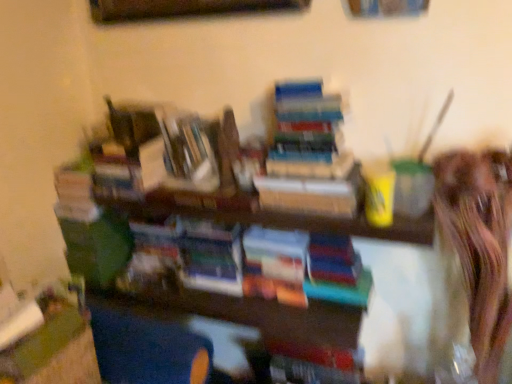
Image resolution: width=512 pixels, height=384 pixels. I want to click on hardcover book at center, the third book viewed from the right, so click(x=211, y=256).

Measure the distance between hardcover books at center, positioned as the fourth book in left-to-right order, and camera.

hardcover books at center, positioned as the fourth book in left-to-right order, is 1.20 meters from camera.

Where is `multicolored paper book at center, which is the third book from left to right`? This screenshot has width=512, height=384. multicolored paper book at center, which is the third book from left to right is located at coordinates pos(276,265).

The width and height of the screenshot is (512, 384). Identify the location of shiny brown hair at right. tap(479, 244).

Locate an element on the screen. Image resolution: width=512 pixels, height=384 pixels. hardcover book at center, acting as the 4th book starting from the right is located at coordinates (75, 195).

Is hardcover books at center, positioned as the fourth book in left-to-right order, to the left of hardcover book at center, arranged as the first book when viewed from the left, from the viewer's perspective?

No, hardcover books at center, positioned as the fourth book in left-to-right order, is not to the left of hardcover book at center, arranged as the first book when viewed from the left.

Is hardcover books at center, the first book when ordered from right to left, oriented towards hardcover book at center, acting as the 4th book starting from the right?

No, hardcover books at center, the first book when ordered from right to left, is not aimed at hardcover book at center, acting as the 4th book starting from the right.

Considering the relative sizes of hardcover books at center, positioned as the fourth book in left-to-right order, and hardcover book at center, acting as the 4th book starting from the right, in the image provided, is hardcover books at center, positioned as the fourth book in left-to-right order, taller than hardcover book at center, acting as the 4th book starting from the right,?

Yes, hardcover books at center, positioned as the fourth book in left-to-right order, is taller than hardcover book at center, acting as the 4th book starting from the right.

From the picture: Which point is more distant from viewer, (x=78, y=213) or (x=243, y=248)?

The point (x=78, y=213) is more distant.

In the image, is hardcover book at center, acting as the 4th book starting from the right, positioned in front of or behind multicolored paper book at center, which is the third book from left to right?

In the image, hardcover book at center, acting as the 4th book starting from the right, appears behind multicolored paper book at center, which is the third book from left to right.

In the image, is hardcover book at center, arranged as the first book when viewed from the left, on the left side or the right side of multicolored paper book at center, the second book positioned from the right?

hardcover book at center, arranged as the first book when viewed from the left, is to the left of multicolored paper book at center, the second book positioned from the right.

From their relative heights in the image, would you say hardcover book at center, arranged as the first book when viewed from the left, is taller or shorter than multicolored paper book at center, the second book positioned from the right?

hardcover book at center, arranged as the first book when viewed from the left, is shorter than multicolored paper book at center, the second book positioned from the right.

From a real-world perspective, relative to shiny brown hair at right, is multicolored paper book at center, which is the third book from left to right, vertically above or below?

multicolored paper book at center, which is the third book from left to right, is below shiny brown hair at right.

Are multicolored paper book at center, which is the third book from left to right, and shiny brown hair at right making contact?

They are not placed beside each other.

Is multicolored paper book at center, which is the third book from left to right, facing away from shiny brown hair at right?

multicolored paper book at center, which is the third book from left to right, does not have its back to shiny brown hair at right.

There is a multicolored paper book at center, which is the third book from left to right. Where is `person above it (from a real-world perspective)`? person above it (from a real-world perspective) is located at coordinates (479, 244).

From the image's perspective, is hardcover book at center, the third book viewed from the right, above or below hardcover book at center, acting as the 4th book starting from the right?

hardcover book at center, the third book viewed from the right, is situated lower than hardcover book at center, acting as the 4th book starting from the right, in the image.

Find the location of a particular element. The width and height of the screenshot is (512, 384). book that is the 1st one when counting downward from the hardcover book at center, arranged as the first book when viewed from the left (from the image's perspective) is located at coordinates (211, 256).

Considering the relative positions of hardcover book at center, the third book viewed from the right, and hardcover book at center, acting as the 4th book starting from the right, in the image provided, is hardcover book at center, the third book viewed from the right, to the right of hardcover book at center, acting as the 4th book starting from the right, from the viewer's perspective?

Yes, hardcover book at center, the third book viewed from the right, is to the right of hardcover book at center, acting as the 4th book starting from the right.

Based on the photo, does hardcover book at center, the third book viewed from the right, have a lesser width compared to hardcover book at center, acting as the 4th book starting from the right?

No.

Which book is the 3rd one when counting from the front of the hardcover book at center, arranged as the first book when viewed from the left? Please provide its 2D coordinates.

[(309, 154)]

Considering the sizes of objects hardcover book at center, acting as the 4th book starting from the right, and hardcover books at center, positioned as the fourth book in left-to-right order, in the image provided, who is shorter, hardcover book at center, acting as the 4th book starting from the right, or hardcover books at center, positioned as the fourth book in left-to-right order,?

hardcover book at center, acting as the 4th book starting from the right.

Between hardcover book at center, arranged as the first book when viewed from the left, and hardcover books at center, the first book when ordered from right to left, which one has smaller width?

With smaller width is hardcover book at center, arranged as the first book when viewed from the left.

Considering their positions, is hardcover book at center, acting as the 4th book starting from the right, located in front of or behind hardcover books at center, positioned as the fourth book in left-to-right order?

In the image, hardcover book at center, acting as the 4th book starting from the right, appears behind hardcover books at center, positioned as the fourth book in left-to-right order.

From the picture: Is multicolored paper book at center, which is the third book from left to right, completely or partially outside of hardcover book at center, the third book viewed from the right?

Indeed, multicolored paper book at center, which is the third book from left to right, is completely outside hardcover book at center, the third book viewed from the right.

Measure the distance between multicolored paper book at center, which is the third book from left to right, and hardcover book at center, positioned as the second book in left-to-right order.

A distance of 13.15 centimeters exists between multicolored paper book at center, which is the third book from left to right, and hardcover book at center, positioned as the second book in left-to-right order.

Identify the location of book that is the 1st object located in front of the hardcover book at center, the third book viewed from the right. (276, 265).

Between point (263, 260) and point (227, 292), which one is positioned behind?

The point (227, 292) is farther.

Is hardcover books at center, the first book when ordered from right to left, positioned with its back to shiny brown hair at right?

No.

Is there a large distance between hardcover books at center, the first book when ordered from right to left, and shiny brown hair at right?

Actually, hardcover books at center, the first book when ordered from right to left, and shiny brown hair at right are a little close together.

Which is more to the left, hardcover books at center, the first book when ordered from right to left, or shiny brown hair at right?

From the viewer's perspective, hardcover books at center, the first book when ordered from right to left, appears more on the left side.

Which is less distant, (x=305, y=187) or (x=456, y=236)?

Point (x=456, y=236)

This screenshot has width=512, height=384. In order to click on the 3rd book in front of the hardcover book at center, acting as the 4th book starting from the right in this screenshot , I will do `click(309, 154)`.

At what (x,y) coordinates should I click in order to perform the action: click on book that is the 2nd one when counting downward from the hardcover book at center, acting as the 4th book starting from the right (from the image's perspective). Please return your answer as a coordinate pair (x, y). Image resolution: width=512 pixels, height=384 pixels. Looking at the image, I should click on (276, 265).

When comparing their distances from shiny brown hair at right, does hardcover books at center, the first book when ordered from right to left, or hardcover book at center, positioned as the second book in left-to-right order, seem closer?

hardcover books at center, the first book when ordered from right to left, is closer to shiny brown hair at right.

Looking at the image, which one is located closer to multicolored paper book at center, which is the third book from left to right, shiny brown hair at right or hardcover books at center, positioned as the fourth book in left-to-right order?

hardcover books at center, positioned as the fourth book in left-to-right order, is positioned closer to the anchor multicolored paper book at center, which is the third book from left to right.

Which object lies nearer to the anchor point multicolored paper book at center, which is the third book from left to right, hardcover books at center, the first book when ordered from right to left, or hardcover book at center, the third book viewed from the right?

hardcover book at center, the third book viewed from the right, is positioned closer to the anchor multicolored paper book at center, which is the third book from left to right.

Based on their spatial positions, is hardcover book at center, positioned as the second book in left-to-right order, or hardcover book at center, acting as the 4th book starting from the right, further from shiny brown hair at right?

hardcover book at center, acting as the 4th book starting from the right, lies further to shiny brown hair at right than the other object.

Which object lies nearer to the anchor point hardcover book at center, positioned as the second book in left-to-right order, hardcover book at center, arranged as the first book when viewed from the left, or shiny brown hair at right?

hardcover book at center, arranged as the first book when viewed from the left, is positioned closer to the anchor hardcover book at center, positioned as the second book in left-to-right order.

From the image, which object appears to be farther from hardcover book at center, positioned as the second book in left-to-right order, shiny brown hair at right or multicolored paper book at center, the second book positioned from the right?

shiny brown hair at right lies further to hardcover book at center, positioned as the second book in left-to-right order, than the other object.

Estimate the real-world distances between objects in this image. Which object is further from hardcover books at center, positioned as the fourth book in left-to-right order, shiny brown hair at right or hardcover book at center, acting as the 4th book starting from the right?

hardcover book at center, acting as the 4th book starting from the right, is positioned further to the anchor hardcover books at center, positioned as the fourth book in left-to-right order.

Looking at the image, which one is located further to hardcover book at center, arranged as the first book when viewed from the left, multicolored paper book at center, the second book positioned from the right, or hardcover book at center, positioned as the second book in left-to-right order?

Among the two, multicolored paper book at center, the second book positioned from the right, is located further to hardcover book at center, arranged as the first book when viewed from the left.

Identify the location of book situated between hardcover book at center, arranged as the first book when viewed from the left, and multicolored paper book at center, which is the third book from left to right, from left to right. (211, 256).

You are a GUI agent. You are given a task and a screenshot of the screen. Output one action in this format:
    pyautogui.click(x=<x>, y=<y>)
    Task: Click on the book situated between multicolored paper book at center, which is the third book from left to right, and shiny brown hair at right from left to right
    The height and width of the screenshot is (384, 512).
    Given the screenshot: What is the action you would take?
    pyautogui.click(x=309, y=154)